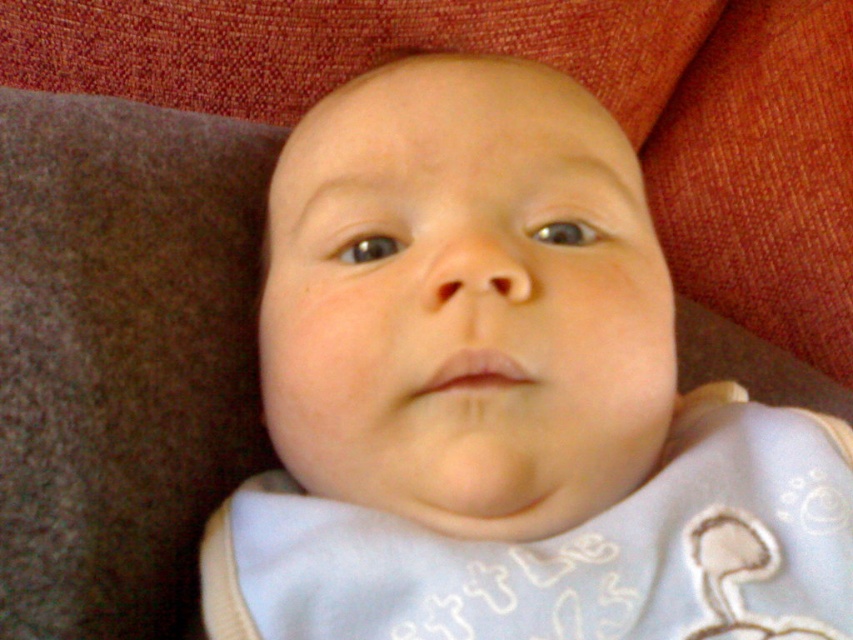
Is soft cotton blanket at upper center below light blue fabric bib at center?

Incorrect, soft cotton blanket at upper center is not positioned below light blue fabric bib at center.

In the scene shown: Is soft cotton blanket at upper center taller than light blue fabric bib at center?

Yes, soft cotton blanket at upper center is taller than light blue fabric bib at center.

Is point (843, 56) positioned behind point (235, 522)?

That is True.

At what (x,y) coordinates should I click in order to perform the action: click on soft cotton blanket at upper center. Please return your answer as a coordinate pair (x, y). This screenshot has width=853, height=640. Looking at the image, I should click on (569, 74).

Can you confirm if smooth white bib at center is thinner than soft cotton blanket at upper center?

Yes, smooth white bib at center is thinner than soft cotton blanket at upper center.

Can you confirm if smooth white bib at center is taller than soft cotton blanket at upper center?

No, smooth white bib at center is not taller than soft cotton blanket at upper center.

Is point (564, 481) farther from viewer compared to point (430, 6)?

No, it is not.

The width and height of the screenshot is (853, 640). In order to click on smooth white bib at center in this screenshot , I will do `click(503, 396)`.

Looking at this image, can you confirm if smooth white bib at center is taller than light blue fabric bib at center?

Yes.

Locate an element on the screen. The height and width of the screenshot is (640, 853). smooth white bib at center is located at coordinates (503, 396).